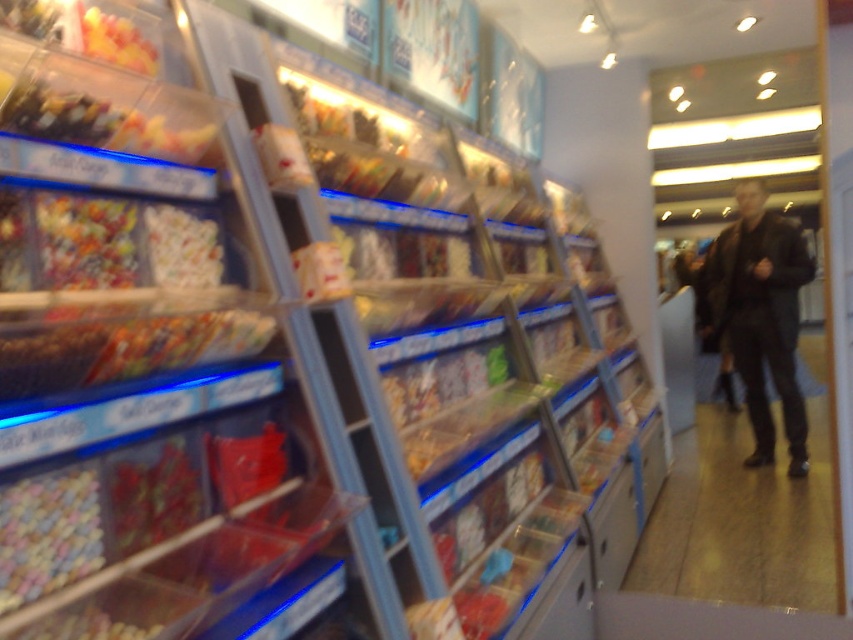
Question: Can you confirm if dark brown leather jacket at right is smaller than pastel mosaic tiles at lower left?

Choices:
 (A) no
 (B) yes

Answer: (A)

Question: Which of the following is the farthest from the observer?

Choices:
 (A) black leather pants at lower right
 (B) pastel mosaic tiles at lower left

Answer: (A)

Question: Estimate the real-world distances between objects in this image. Which object is closer to the black leather pants at lower right?

Choices:
 (A) dark brown leather jacket at right
 (B) pastel mosaic tiles at lower left

Answer: (A)

Question: Does black leather pants at lower right appear over dark brown leather jacket at right?

Choices:
 (A) no
 (B) yes

Answer: (A)

Question: Is dark brown leather jacket at right bigger than pastel mosaic tiles at lower left?

Choices:
 (A) no
 (B) yes

Answer: (B)

Question: Which point is farther to the camera?

Choices:
 (A) (820, 371)
 (B) (764, 333)
 (C) (99, 554)

Answer: (A)